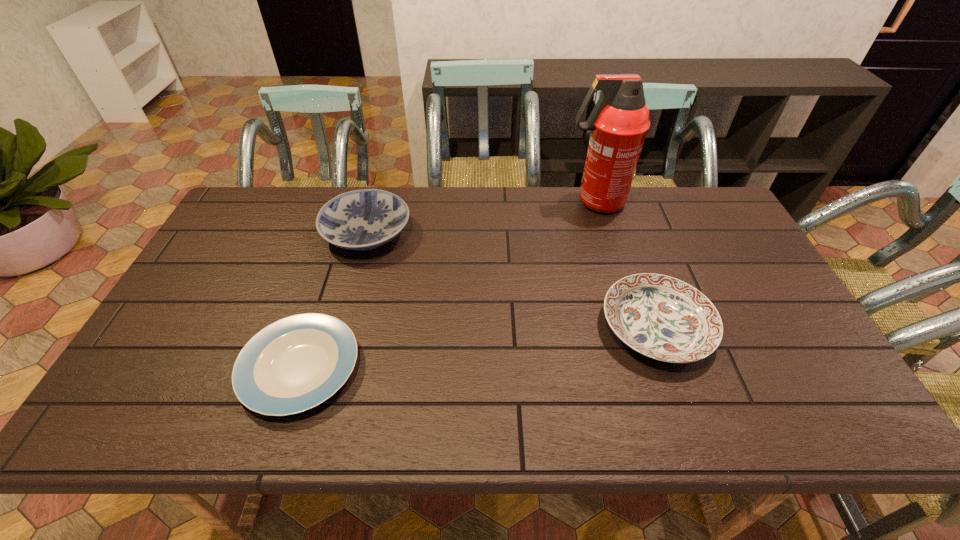
At what (x,y) coordinates should I click in order to perform the action: click on free space located on the left of the second shortest plate. Please return your answer as a coordinate pair (x, y). This screenshot has height=540, width=960. Looking at the image, I should click on (505, 326).

At what (x,y) coordinates should I click in order to perform the action: click on free location located 0.330m on the back of the shortest plate. Please return your answer as a coordinate pair (x, y). Image resolution: width=960 pixels, height=540 pixels. Looking at the image, I should click on (343, 238).

Find the location of a particular element. fire extinguisher that is at the far edge is located at coordinates (619, 122).

Where is `plate present at the far edge`? The image size is (960, 540). plate present at the far edge is located at coordinates (365, 219).

You are a GUI agent. You are given a task and a screenshot of the screen. Output one action in this format:
    pyautogui.click(x=<x>, y=<y>)
    Task: Click on the object at the near edge
    The height and width of the screenshot is (540, 960).
    Given the screenshot: What is the action you would take?
    pyautogui.click(x=296, y=363)

This screenshot has width=960, height=540. In the image, there is a desktop. What are the coordinates of `blank space at the far edge` in the screenshot? It's located at (294, 214).

This screenshot has height=540, width=960. I want to click on free region at the near edge of the desktop, so click(664, 400).

The image size is (960, 540). Find the location of `blank space at the right edge`. blank space at the right edge is located at coordinates (725, 236).

Identify the location of vacant space at the near left corner of the desktop. (95, 433).

Where is `vacant region at the far right corner`? The height and width of the screenshot is (540, 960). vacant region at the far right corner is located at coordinates (710, 187).